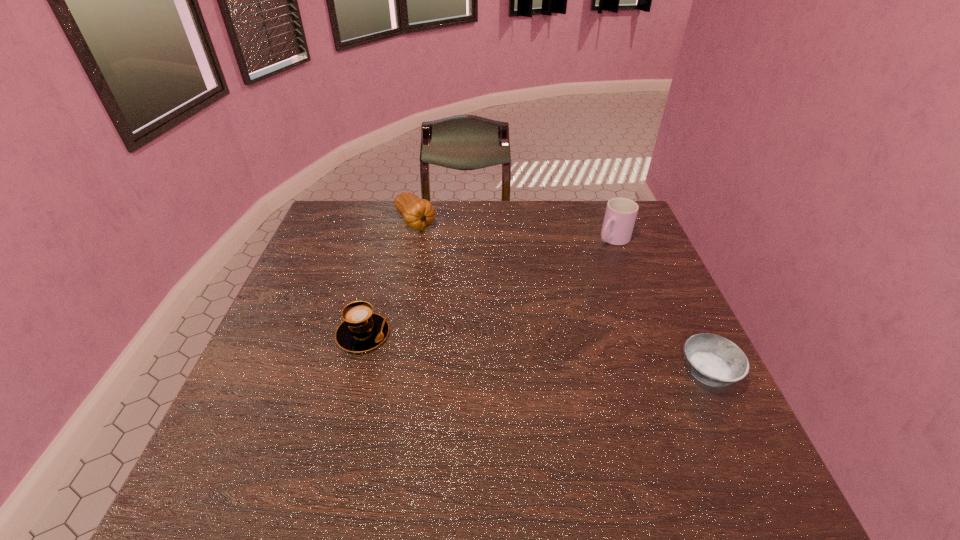
You are a GUI agent. You are given a task and a screenshot of the screen. Output one action in this format:
    pyautogui.click(x=<x>, y=<y>)
    Task: Click on the free space at the right edge of the desktop
    
    Given the screenshot: What is the action you would take?
    point(644,246)

This screenshot has width=960, height=540. What are the coordinates of `vacant space at the far left corner of the desktop` in the screenshot? It's located at (320, 221).

The image size is (960, 540). Identify the location of free point at the near left corner. (259, 414).

This screenshot has height=540, width=960. In the image, there is a desktop. In order to click on free space at the far right corner in this screenshot , I will do `click(601, 215)`.

In the image, there is a desktop. Identify the location of vacant space at the near right corner. (707, 420).

What are the coordinates of `free area in between the second shortest object and the gourd` in the screenshot? It's located at (389, 278).

Find the location of `vacant area between the second shortest object and the shortest object`. vacant area between the second shortest object and the shortest object is located at coordinates click(x=536, y=353).

I want to click on vacant space that's between the gourd and the cup, so click(515, 231).

This screenshot has width=960, height=540. In order to click on vacant area between the second shortest object and the gourd in this screenshot , I will do `click(389, 278)`.

The image size is (960, 540). Find the location of `free area in between the gourd and the shortest object`. free area in between the gourd and the shortest object is located at coordinates (562, 298).